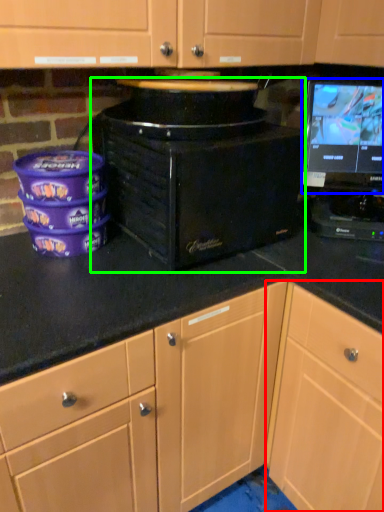
Question: Estimate the real-world distances between objects in this image. Which object is farther from cabinetry (highlighted by a red box), computer monitor (highlighted by a blue box) or home appliance (highlighted by a green box)?

Choices:
 (A) computer monitor
 (B) home appliance

Answer: (A)